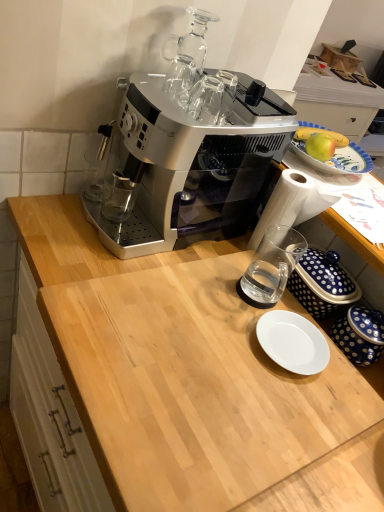
Image resolution: width=384 pixels, height=512 pixels. Find the location of `free space that is to the left of white glossy plate at center`. free space that is to the left of white glossy plate at center is located at coordinates (208, 318).